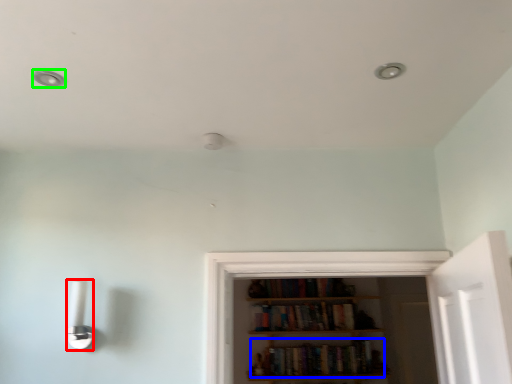
Question: Based on their relative distances, which object is farther from light fixture (highlighted by a red box)? Choose from book (highlighted by a blue box) and dot (highlighted by a green box).

Choices:
 (A) book
 (B) dot

Answer: (A)